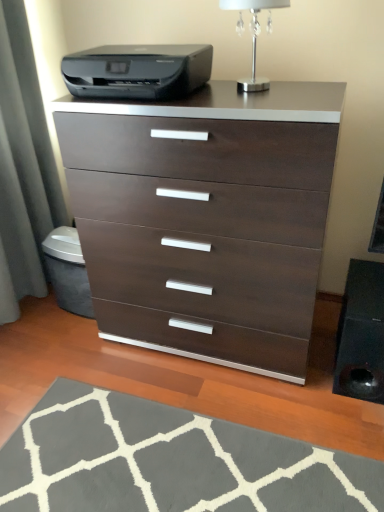
At what (x,y) coordinates should I click in order to perform the action: click on blank space to the left of dark wood/finish chest of drawers at center. Please return your answer as a coordinate pair (x, y). Looking at the image, I should click on (63, 370).